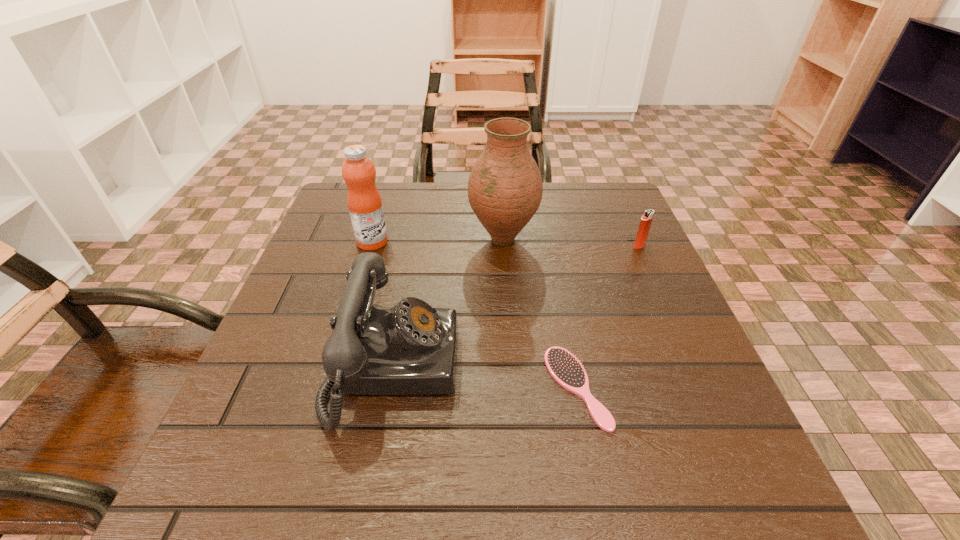
Find the location of a particular element. free space located 0.350m on the back of the hairbrush is located at coordinates (547, 234).

Locate an element on the screen. vase that is at the far edge is located at coordinates (505, 187).

Where is `fruit juice that is at the far edge`? This screenshot has height=540, width=960. fruit juice that is at the far edge is located at coordinates (364, 202).

Locate an element on the screen. The height and width of the screenshot is (540, 960). fruit juice that is at the left edge is located at coordinates (364, 202).

The image size is (960, 540). In order to click on telephone at the left edge in this screenshot , I will do `click(410, 349)`.

Identify the location of object positioned at the right edge. (645, 223).

You are a GUI agent. You are given a task and a screenshot of the screen. Output one action in this format:
    pyautogui.click(x=<x>, y=<y>)
    Task: Click on the object located in the far left corner section of the desktop
    This screenshot has height=540, width=960.
    Given the screenshot: What is the action you would take?
    pyautogui.click(x=364, y=202)

In the image, there is a desktop. Identify the location of vacant space at the far edge. The height and width of the screenshot is (540, 960). (420, 208).

In the image, there is a desktop. Where is `vacant region at the near edge`? The image size is (960, 540). vacant region at the near edge is located at coordinates (442, 505).

This screenshot has height=540, width=960. I want to click on vacant region at the left edge of the desktop, so click(329, 288).